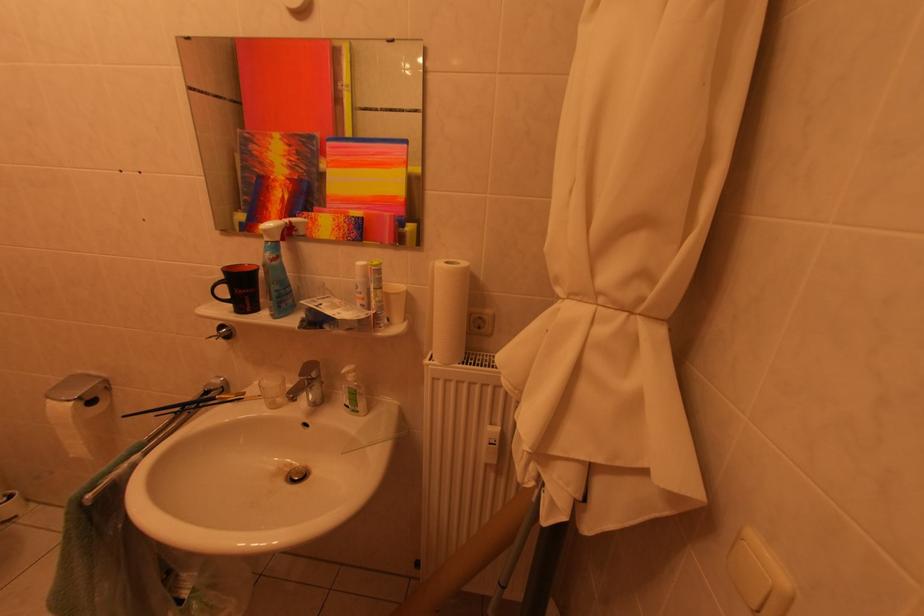
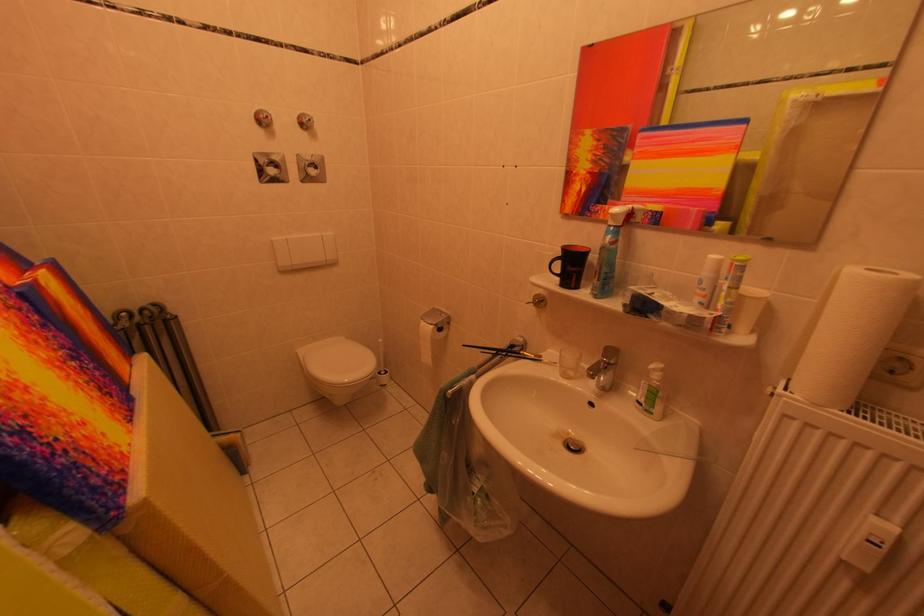
Find the pixel in the second image that matches pixel 225 341 in the first image.

(541, 308)